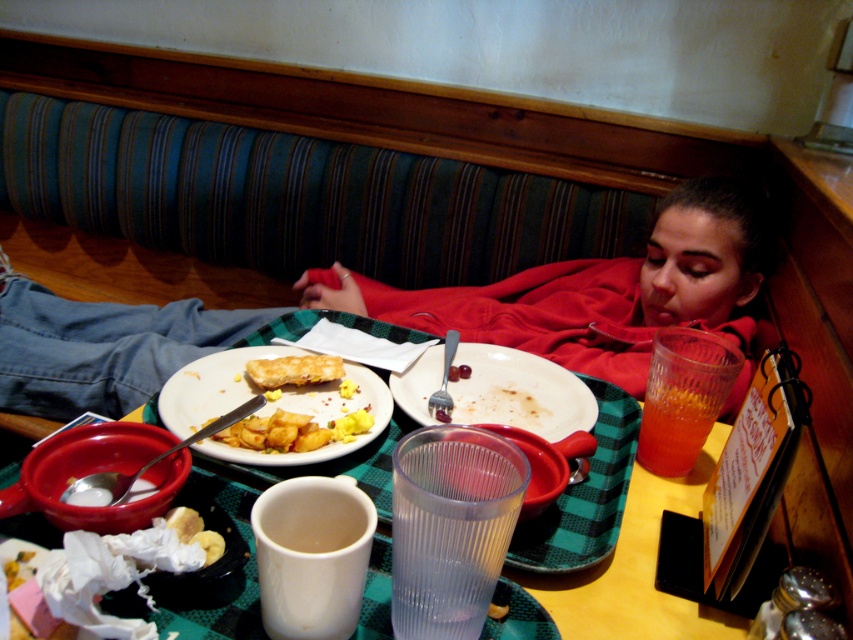
In the scene shown: You are a waiter trying to clear the table. There is a point marked at coordinates [561,408] on the table. Can you reach this point from your current position without moving your chair?

The distance between the point at coordinates [561,408] and the viewer is 37.11 inches. Since the average person can reach about 24 to 30 inches comfortably, you would not be able to reach this point without moving your chair.

Consider the image. You are a customer who just arrived at the booth and want to grab your drink first. Given the layout of the table, which object should you reach towards first, the translucent glass drink at upper right or the golden crispy pastry at center?

You should reach towards the translucent glass drink at upper right first because it is positioned to the right of the golden crispy pastry at center, making it more accessible from your seated position.

You are a waiter trying to clear the table. Where exactly is the white matte plate at center located on the table?

The white matte plate at center is located at the coordinates point (519, 392) on the table.